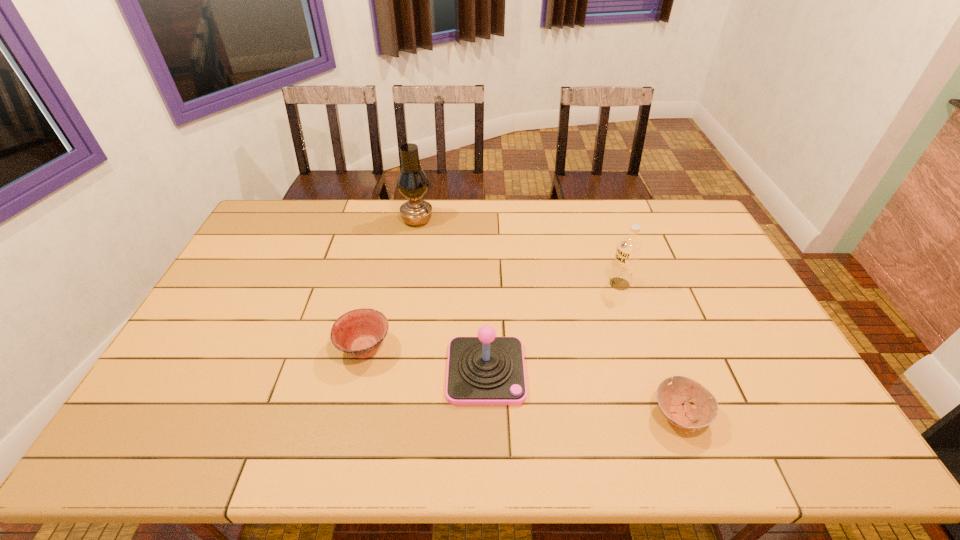
Where is `free location located on the right of the tallest object`? The width and height of the screenshot is (960, 540). free location located on the right of the tallest object is located at coordinates (460, 220).

This screenshot has height=540, width=960. Find the location of `free region located on the front label of the vodka`. free region located on the front label of the vodka is located at coordinates (542, 284).

Find the location of a particular element. The image size is (960, 540). vacant space located on the front label of the vodka is located at coordinates (530, 284).

The image size is (960, 540). In order to click on free location located on the front label of the vodka in this screenshot , I will do `click(540, 284)`.

The height and width of the screenshot is (540, 960). In order to click on vacant space situated forward from the base of the third shortest object in this screenshot , I will do `click(487, 453)`.

Locate an element on the screen. The width and height of the screenshot is (960, 540). free space located on the left of the second shortest object is located at coordinates (254, 348).

The width and height of the screenshot is (960, 540). I want to click on free space located 0.060m on the left of the right bowl, so click(x=626, y=414).

Locate an element on the screen. The width and height of the screenshot is (960, 540). object present at the far edge is located at coordinates (412, 182).

Identify the location of object present at the near edge. (670, 398).

In the image, there is a desktop. In order to click on blank space at the far edge in this screenshot , I will do `click(384, 210)`.